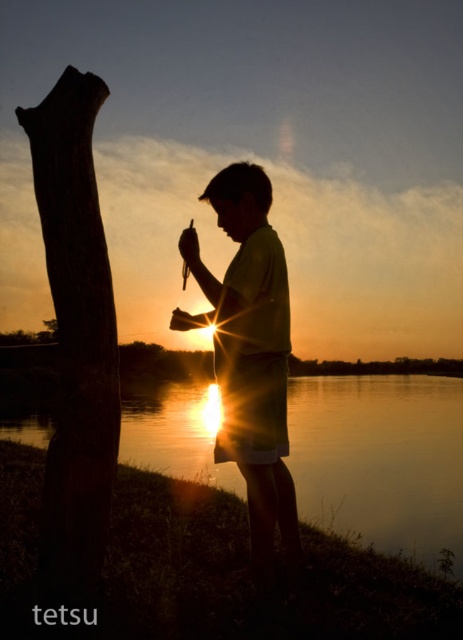
Does glistening water at lower center have a larger size compared to dark brown rough tree trunk at left?

Indeed, glistening water at lower center has a larger size compared to dark brown rough tree trunk at left.

This screenshot has width=463, height=640. What do you see at coordinates (381, 460) in the screenshot? I see `glistening water at lower center` at bounding box center [381, 460].

Where is `glistening water at lower center`? This screenshot has width=463, height=640. glistening water at lower center is located at coordinates (381, 460).

Who is shorter, glistening water at lower center or silhouette fabric at center?

silhouette fabric at center is shorter.

Which is more to the right, glistening water at lower center or silhouette fabric at center?

From the viewer's perspective, silhouette fabric at center appears more on the right side.

Who is more forward, (138, 436) or (204, 323)?

Point (204, 323) is in front.

I want to click on glistening water at lower center, so click(381, 460).

Can you confirm if dark brown rough tree trunk at left is positioned to the left of silhouette fabric at center?

Correct, you'll find dark brown rough tree trunk at left to the left of silhouette fabric at center.

Does point (58, 160) lie in front of point (275, 360)?

Yes, it is in front of point (275, 360).

Find the location of a particular element. dark brown rough tree trunk at left is located at coordinates (75, 330).